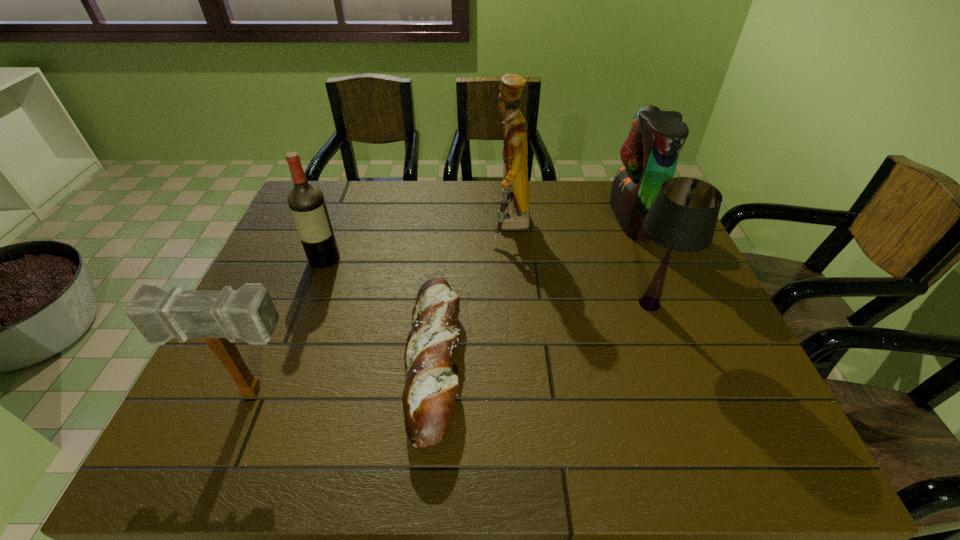
Identify the location of free region located on the front-facing side of the fourth object from left to right. The width and height of the screenshot is (960, 540). (377, 227).

You are a GUI agent. You are given a task and a screenshot of the screen. Output one action in this format:
    pyautogui.click(x=<x>, y=<y>)
    Task: Click on the free region located at the face of the parrot
    The width and height of the screenshot is (960, 540).
    Given the screenshot: What is the action you would take?
    pyautogui.click(x=487, y=217)

You are a GUI agent. You are given a task and a screenshot of the screen. Output one action in this format:
    pyautogui.click(x=<x>, y=<y>)
    Task: Click on the free region located 0.310m at the face of the parrot
    This screenshot has width=960, height=540.
    Given the screenshot: What is the action you would take?
    pos(515,217)

Find the location of `vacant space situated at the face of the parrot`. vacant space situated at the face of the parrot is located at coordinates (594, 217).

Where is `vacant space situated 0.320m on the front-facing side of the lampshade`? vacant space situated 0.320m on the front-facing side of the lampshade is located at coordinates (495, 304).

Where is `vacant space situated 0.340m on the front-facing side of the lampshade`? The image size is (960, 540). vacant space situated 0.340m on the front-facing side of the lampshade is located at coordinates 488,304.

Where is `free location located 0.200m on the front-facing side of the lampshade`? The image size is (960, 540). free location located 0.200m on the front-facing side of the lampshade is located at coordinates (542, 304).

Locate an element on the screen. blank area located 0.200m on the front-facing side of the third farthest object is located at coordinates (300, 325).

This screenshot has width=960, height=540. In order to click on free region located 0.170m on the right of the mallet in this screenshot , I will do `click(385, 392)`.

Locate an element on the screen. The image size is (960, 540). free region located on the right of the shortest object is located at coordinates (566, 361).